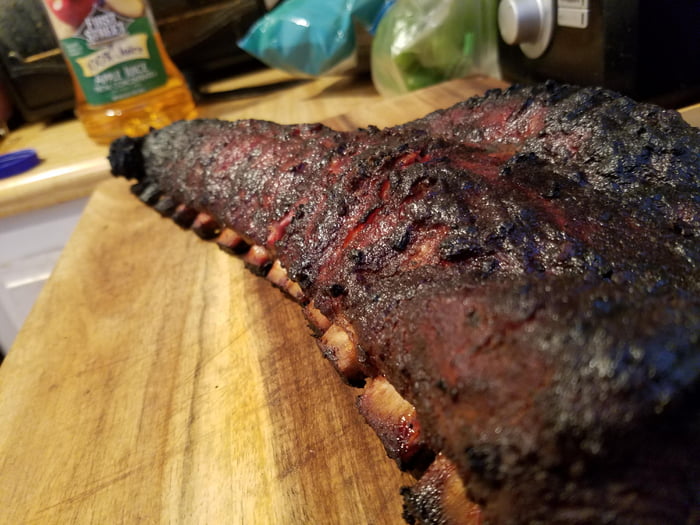
The image size is (700, 525). What are the coordinates of `grain of wood` in the screenshot? It's located at (192, 377).